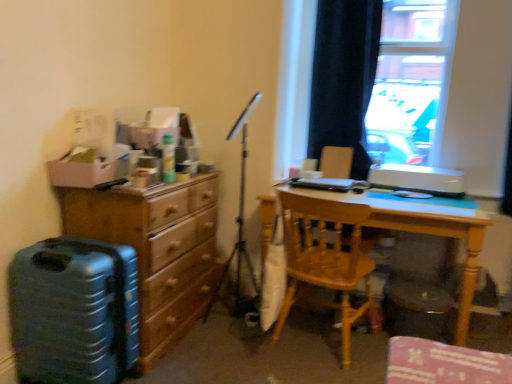
Question: From a real-world perspective, is transparent glass window at upper right positioned under wooden chair at center based on gravity?

Choices:
 (A) yes
 (B) no

Answer: (B)

Question: Could wooden chair at center be considered to be inside transparent glass window at upper right?

Choices:
 (A) no
 (B) yes

Answer: (A)

Question: From a real-world perspective, is transparent glass window at upper right on wooden chair at center?

Choices:
 (A) yes
 (B) no

Answer: (A)

Question: Can you confirm if transparent glass window at upper right is positioned to the right of wooden chair at center?

Choices:
 (A) no
 (B) yes

Answer: (B)

Question: Are transparent glass window at upper right and wooden chair at center located far from each other?

Choices:
 (A) yes
 (B) no

Answer: (A)

Question: Is transparent glass window at upper right oriented away from wooden chair at center?

Choices:
 (A) yes
 (B) no

Answer: (B)

Question: Is light wood desk at center positioned before transparent glass window at upper right?

Choices:
 (A) no
 (B) yes

Answer: (B)

Question: Is light wood desk at center taller than transparent glass window at upper right?

Choices:
 (A) yes
 (B) no

Answer: (B)

Question: Does light wood desk at center lie behind transparent glass window at upper right?

Choices:
 (A) yes
 (B) no

Answer: (B)

Question: Is light wood desk at center positioned far away from transparent glass window at upper right?

Choices:
 (A) no
 (B) yes

Answer: (A)

Question: Considering the relative sizes of light wood desk at center and transparent glass window at upper right in the image provided, is light wood desk at center shorter than transparent glass window at upper right?

Choices:
 (A) no
 (B) yes

Answer: (B)

Question: From the image's perspective, is light wood desk at center above transparent glass window at upper right?

Choices:
 (A) yes
 (B) no

Answer: (B)

Question: Considering the relative sizes of wooden chair at center and metallic tripod at center in the image provided, is wooden chair at center smaller than metallic tripod at center?

Choices:
 (A) no
 (B) yes

Answer: (A)